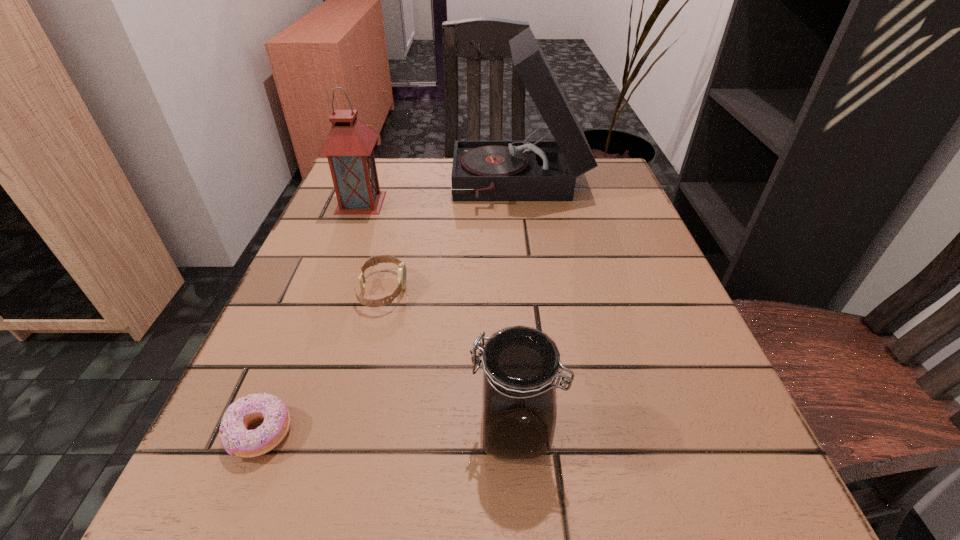
Locate an element on the screen. object at the right edge is located at coordinates (525, 170).

At what (x,y) coordinates should I click in order to perform the action: click on object that is at the far left corner. Please return your answer as a coordinate pair (x, y). The image size is (960, 540). Looking at the image, I should click on (349, 145).

In order to click on object that is positioned at the far right corner in this screenshot , I will do `click(525, 170)`.

Where is `free space at the far edge`? The image size is (960, 540). free space at the far edge is located at coordinates (413, 192).

Identify the location of free region at the near edge. (379, 514).

Locate an element on the screen. vacant space at the left edge is located at coordinates (218, 433).

You are a GUI agent. You are given a task and a screenshot of the screen. Output one action in this format:
    pyautogui.click(x=<x>, y=<y>)
    Task: Click on the free location at the right edge
    This screenshot has height=540, width=960.
    Given the screenshot: What is the action you would take?
    pyautogui.click(x=637, y=350)

In the image, there is a desktop. What are the coordinates of `vacant space at the near right corner` in the screenshot? It's located at (719, 536).

Locate an element on the screen. This screenshot has width=960, height=540. unoccupied area between the phonograph_record and the doughnut is located at coordinates click(x=390, y=309).

At what (x,y) coordinates should I click in order to perform the action: click on vacant space that's between the jar and the third object from right to left. Please return your answer as a coordinate pair (x, y). This screenshot has height=540, width=960. Looking at the image, I should click on (448, 360).